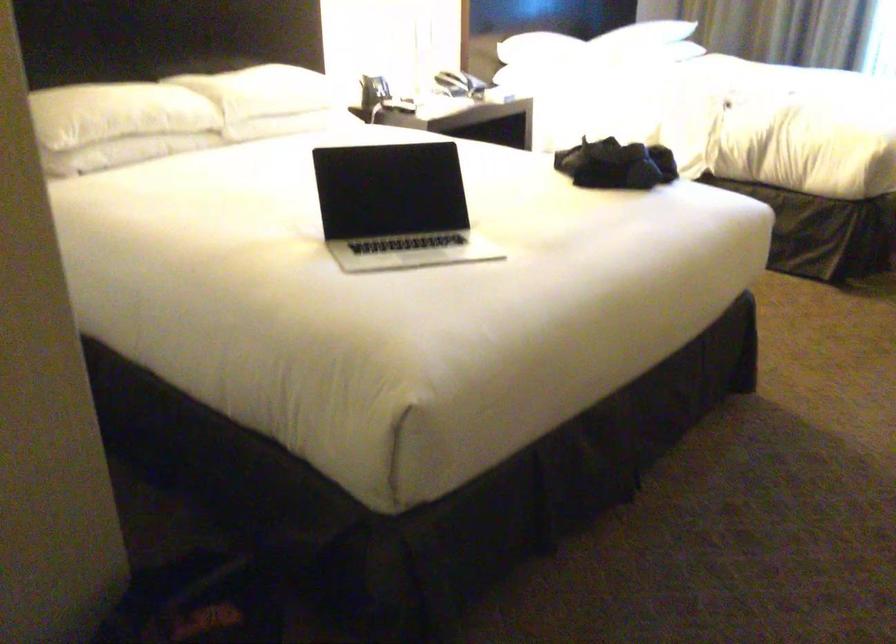
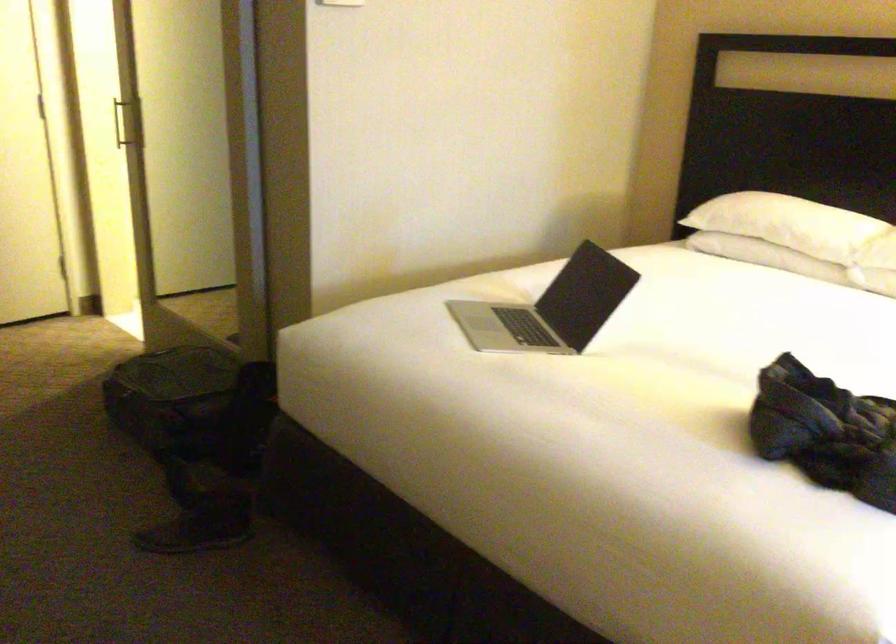
Where in the second image is the point corresponding to point 640,160 from the first image?

(825, 431)